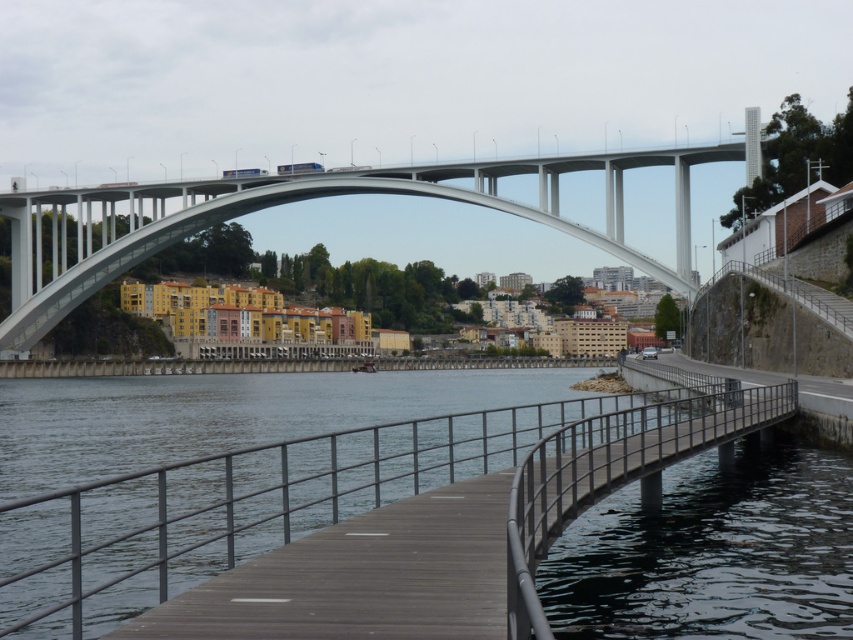
Can you confirm if wooden at center is thinner than white concrete arch bridge at upper center?

Yes.

Between wooden at center and white concrete arch bridge at upper center, which one appears on the left side from the viewer's perspective?

From the viewer's perspective, white concrete arch bridge at upper center appears more on the left side.

You are a GUI agent. You are given a task and a screenshot of the screen. Output one action in this format:
    pyautogui.click(x=<x>, y=<y>)
    Task: Click on the wooden at center
    
    Given the screenshot: What is the action you would take?
    pyautogui.click(x=340, y=496)